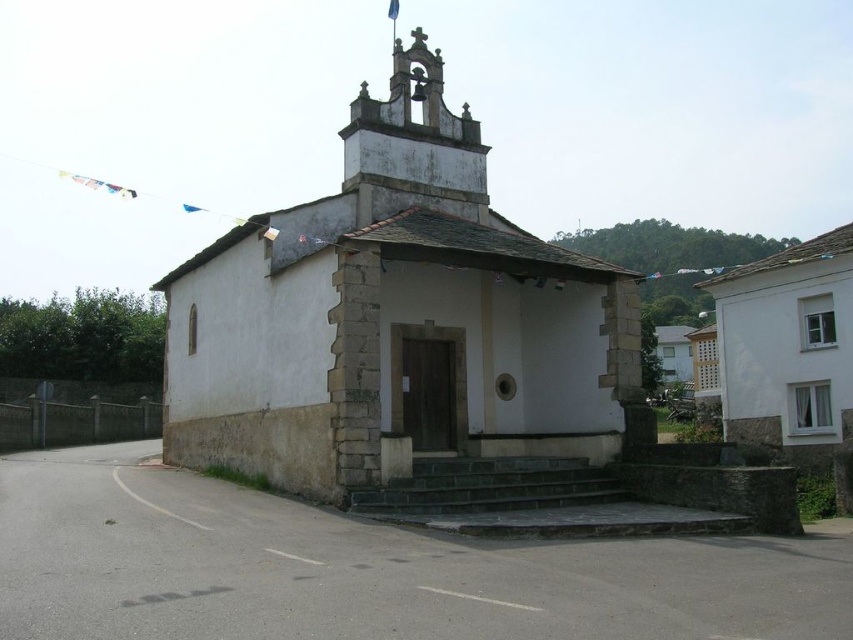
In the scene shown: Which is more to the left, white stone chapel at center or dark gray stone stairs at center?

From the viewer's perspective, white stone chapel at center appears more on the left side.

Is white stone chapel at center thinner than dark gray stone stairs at center?

No, white stone chapel at center is not thinner than dark gray stone stairs at center.

Which is behind, point (457, 301) or point (625, 493)?

The point (457, 301) is more distant.

At what (x,y) coordinates should I click in order to perform the action: click on white stone chapel at center. Please return your answer as a coordinate pair (x, y). The height and width of the screenshot is (640, 853). Looking at the image, I should click on (396, 320).